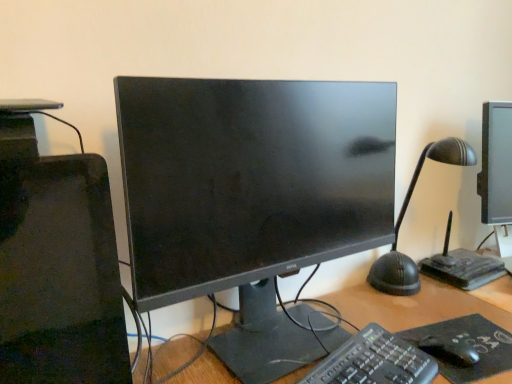
Question: Considering their positions, is black plastic keyboard at center located in front of or behind black matte mouse at lower right?

Choices:
 (A) behind
 (B) front

Answer: (B)

Question: From a real-world perspective, relative to black matte mouse at lower right, is black plastic keyboard at center vertically above or below?

Choices:
 (A) below
 (B) above

Answer: (B)

Question: Which of these objects is positioned farthest from the black matte mousepad at lower right?

Choices:
 (A) black plastic keyboard at center
 (B) matte black monitor at center
 (C) black matte mouse at lower right

Answer: (B)

Question: Which of these objects is positioned closest to the black matte mousepad at lower right?

Choices:
 (A) black plastic keyboard at center
 (B) matte black monitor at center
 (C) black matte mouse at lower right

Answer: (C)